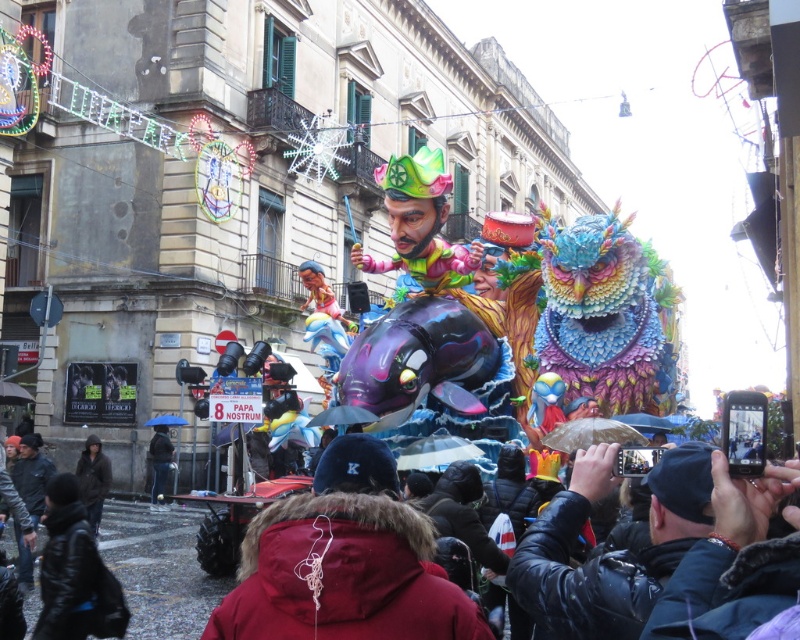
Question: Which point appears farthest from the camera in this image?

Choices:
 (A) (584, 618)
 (B) (93, 497)

Answer: (B)

Question: Which object appears farthest from the camera in this image?

Choices:
 (A) red fur coat at center
 (B) dark blue leather jacket at lower right
 (C) dark brown leather jacket at lower left

Answer: (C)

Question: Does red fur coat at center appear on the left side of dark blue leather jacket at lower right?

Choices:
 (A) yes
 (B) no

Answer: (A)

Question: In this image, where is dark blue leather jacket at lower right located relative to dark brown leather jacket at lower left?

Choices:
 (A) right
 (B) left

Answer: (A)

Question: Can you confirm if red fur coat at center is positioned to the left of dark blue leather jacket at lower right?

Choices:
 (A) no
 (B) yes

Answer: (B)

Question: Which object is positioned farthest from the red fur coat at center?

Choices:
 (A) dark brown leather jacket at lower left
 (B) dark blue leather jacket at lower right

Answer: (A)